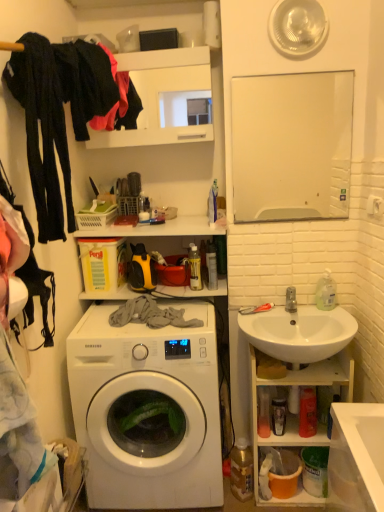
This screenshot has width=384, height=512. Find the location of `vacant space to the right of silver metallic faucet at sink right`. vacant space to the right of silver metallic faucet at sink right is located at coordinates (329, 310).